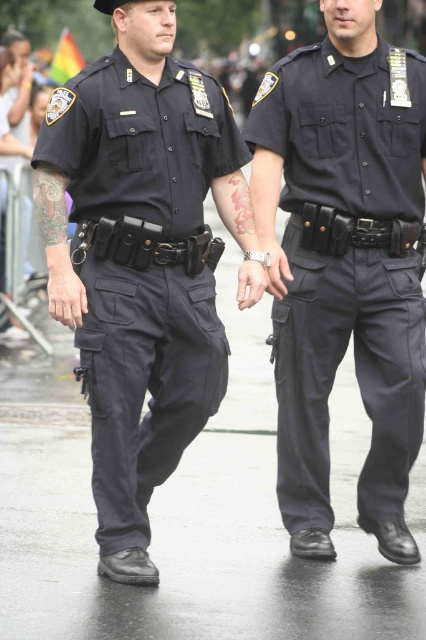
You are a photographer trying to capture a clear shot of both the matte black uniform at center and the matte black uniform at left. Since the background is crowded, you need to adjust your camera focus. Which uniform should you focus on to ensure it appears sharp in the photo?

The matte black uniform at center is positioned over the matte black uniform at left, so focusing on the matte black uniform at center will keep it sharp while the one behind may appear slightly blurred.

Based on the scene description, where is the matte black uniform at center located in terms of coordinates?

The matte black uniform at center is located at coordinates point (345, 269).